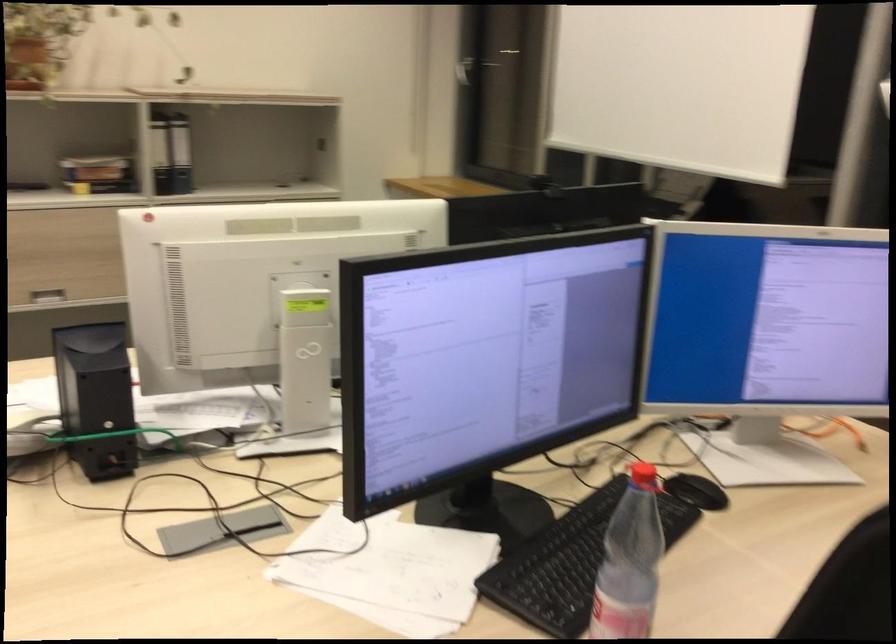
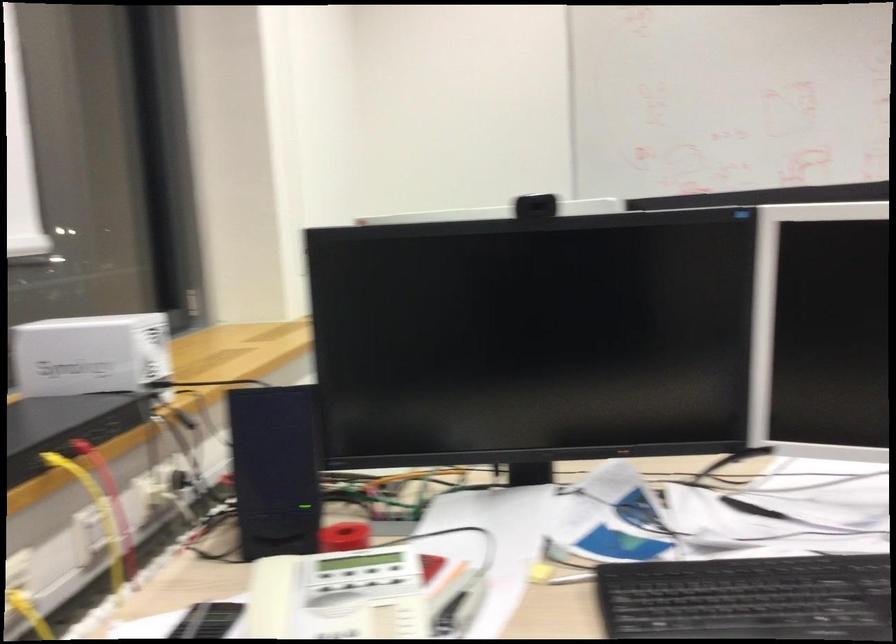
Question: I am providing you with two images of the same scene from different viewpoints. After the viewpoint changes to image2, which objects are now occluded?

Choices:
 (A) black webcam
 (B) red bottle cap
 (C) onion
 (D) black computer keyboard

Answer: (B)